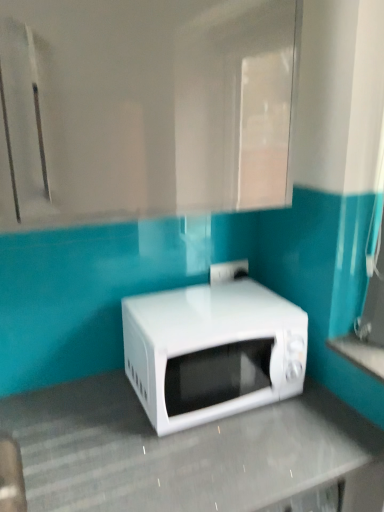
What are the coordinates of `blank area to the left of white glossy microwave at center` in the screenshot? It's located at (98, 404).